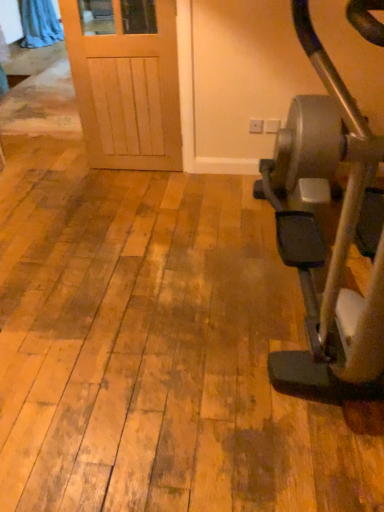
This screenshot has height=512, width=384. Describe the element at coordinates (39, 24) in the screenshot. I see `blue fabric curtain at upper left` at that location.

What are the coordinates of `blue fabric curtain at upper left` in the screenshot? It's located at (39, 24).

I want to click on metallic gray stationary bicycle at right, so click(335, 237).

What do you see at coordinates (335, 237) in the screenshot? The height and width of the screenshot is (512, 384). I see `metallic gray stationary bicycle at right` at bounding box center [335, 237].

Find the location of a particular element. The height and width of the screenshot is (512, 384). blue fabric curtain at upper left is located at coordinates (39, 24).

Is metallic gray stationary bicycle at right to the left or to the right of blue fabric curtain at upper left in the image?

metallic gray stationary bicycle at right is positioned on blue fabric curtain at upper left's right side.

Is metallic gray stationary bicycle at right positioned before blue fabric curtain at upper left?

That is True.

Considering the positions of points (317, 394) and (55, 28), is point (317, 394) farther from camera compared to point (55, 28)?

No, it is in front of (55, 28).

From the image's perspective, which one is positioned lower, metallic gray stationary bicycle at right or blue fabric curtain at upper left?

metallic gray stationary bicycle at right appears lower in the image.

From a real-world perspective, is metallic gray stationary bicycle at right on top of blue fabric curtain at upper left?

Yes, from a real-world perspective, metallic gray stationary bicycle at right is over blue fabric curtain at upper left

Can you confirm if metallic gray stationary bicycle at right is wider than blue fabric curtain at upper left?

Indeed, metallic gray stationary bicycle at right has a greater width compared to blue fabric curtain at upper left.

Who is taller, metallic gray stationary bicycle at right or blue fabric curtain at upper left?

Standing taller between the two is metallic gray stationary bicycle at right.

Which of these two, metallic gray stationary bicycle at right or blue fabric curtain at upper left, is smaller?

Smaller between the two is blue fabric curtain at upper left.

Would you say metallic gray stationary bicycle at right contains blue fabric curtain at upper left?

Actually, blue fabric curtain at upper left is outside metallic gray stationary bicycle at right.

Based on the photo, are metallic gray stationary bicycle at right and blue fabric curtain at upper left far apart?

metallic gray stationary bicycle at right is positioned a significant distance from blue fabric curtain at upper left.

Is metallic gray stationary bicycle at right oriented away from blue fabric curtain at upper left?

No, metallic gray stationary bicycle at right's orientation is not away from blue fabric curtain at upper left.

Locate an element on the screen. This screenshot has width=384, height=512. curtain on the left of metallic gray stationary bicycle at right is located at coordinates (39, 24).

Visually, is blue fabric curtain at upper left positioned to the left or to the right of metallic gray stationary bicycle at right?

Clearly, blue fabric curtain at upper left is on the left of metallic gray stationary bicycle at right in the image.

Considering the positions of objects blue fabric curtain at upper left and metallic gray stationary bicycle at right in the image provided, who is behind, blue fabric curtain at upper left or metallic gray stationary bicycle at right?

Positioned behind is blue fabric curtain at upper left.

Does point (42, 30) come farther from viewer compared to point (383, 234)?

Yes, it is.

From the image's perspective, between blue fabric curtain at upper left and metallic gray stationary bicycle at right, who is located below?

metallic gray stationary bicycle at right appears lower in the image.

From a real-world perspective, is blue fabric curtain at upper left beneath metallic gray stationary bicycle at right?

Correct, in the physical world, blue fabric curtain at upper left is lower than metallic gray stationary bicycle at right.

Which object is wider, blue fabric curtain at upper left or metallic gray stationary bicycle at right?

With larger width is metallic gray stationary bicycle at right.

Which of these two, blue fabric curtain at upper left or metallic gray stationary bicycle at right, stands shorter?

With less height is blue fabric curtain at upper left.

Between blue fabric curtain at upper left and metallic gray stationary bicycle at right, which one has smaller size?

Smaller between the two is blue fabric curtain at upper left.

Can we say blue fabric curtain at upper left lies outside metallic gray stationary bicycle at right?

blue fabric curtain at upper left is positioned outside metallic gray stationary bicycle at right.

Would you consider blue fabric curtain at upper left to be distant from metallic gray stationary bicycle at right?

Indeed, blue fabric curtain at upper left is not near metallic gray stationary bicycle at right.

Is blue fabric curtain at upper left facing away from metallic gray stationary bicycle at right?

No, metallic gray stationary bicycle at right is not at the back of blue fabric curtain at upper left.

Find the location of `stationary bicycle below the blue fabric curtain at upper left (from the image's perspective)`. stationary bicycle below the blue fabric curtain at upper left (from the image's perspective) is located at coordinates (335, 237).

This screenshot has height=512, width=384. Identify the location of curtain above the metallic gray stationary bicycle at right (from the image's perspective). (39, 24).

In the image, there is a metallic gray stationary bicycle at right. What are the coordinates of `curtain below it (from a real-world perspective)` in the screenshot? It's located at (39, 24).